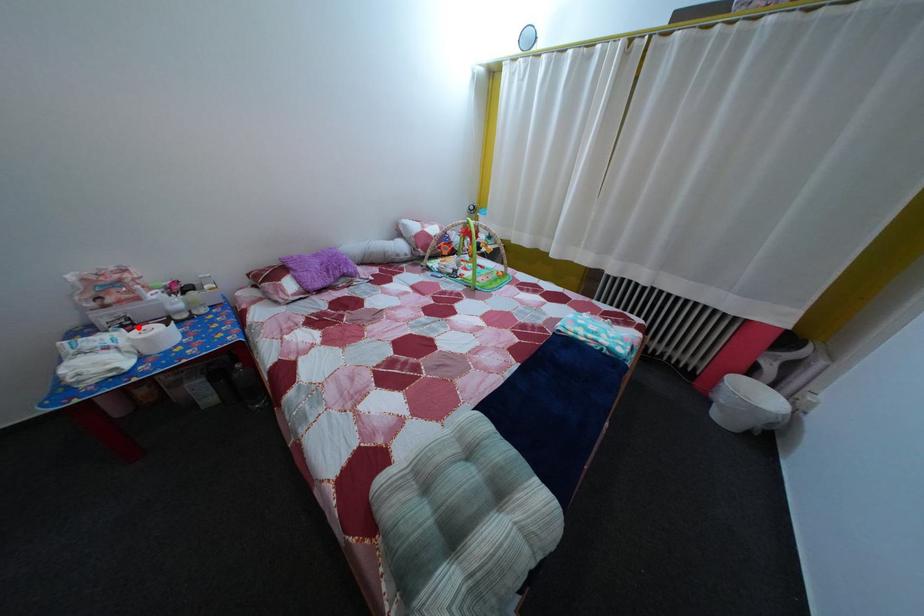
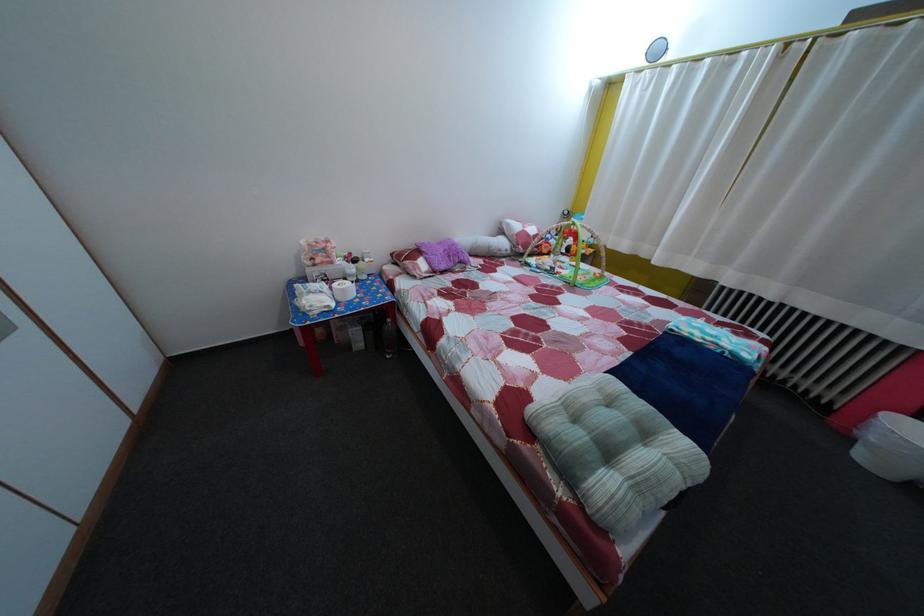
Question: I am providing you with two images of the same scene from different viewpoints. In image1, a red point is highlighted. Considering the same 3D point in image2, which of the following is correct?

Choices:
 (A) It is closer
 (B) It is farther

Answer: (A)